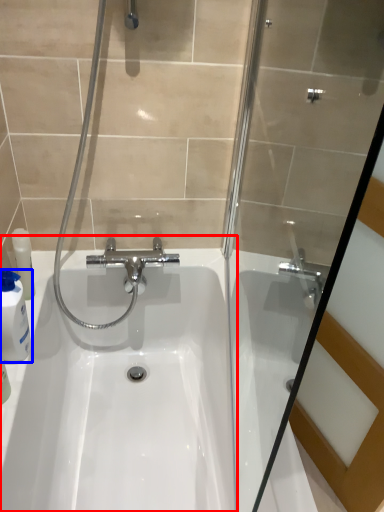
Question: Among these objects, which one is nearest to the camera, sink (highlighted by a red box) or cleaning product (highlighted by a blue box)?

Choices:
 (A) sink
 (B) cleaning product

Answer: (A)